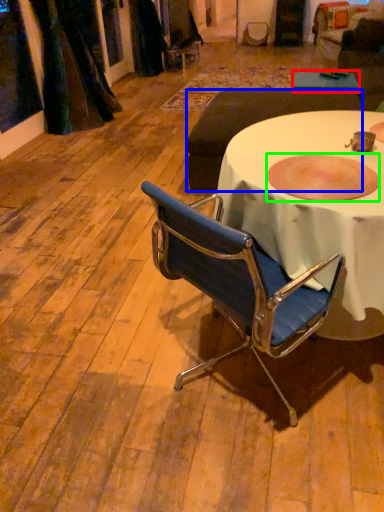
Question: Which object is positioned farthest from table (highlighted by a red box)? Select from studio couch (highlighted by a blue box) and bowl (highlighted by a green box).

Choices:
 (A) studio couch
 (B) bowl

Answer: (B)